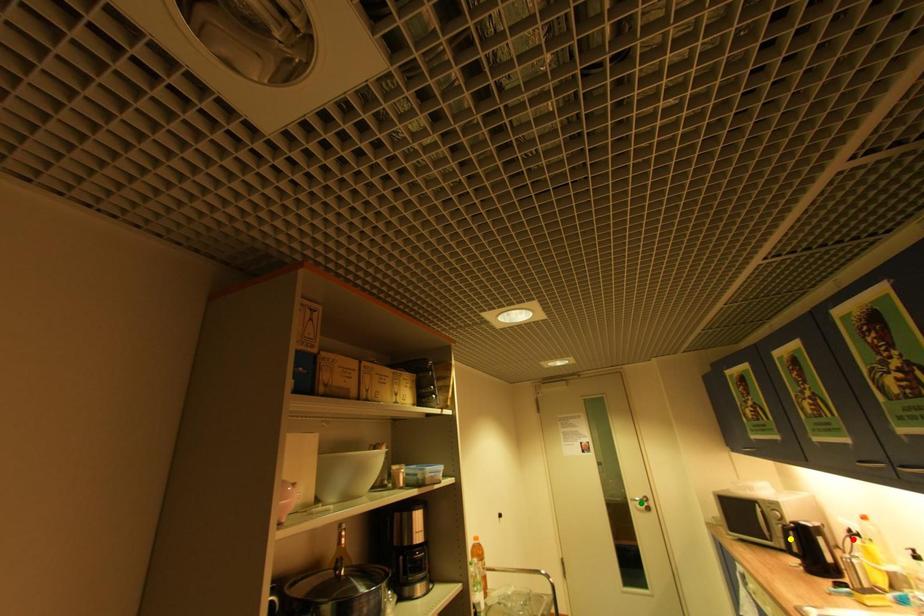
Order these from nearest to farthest:
A) green point
B) yellow point
C) red point

green point, yellow point, red point